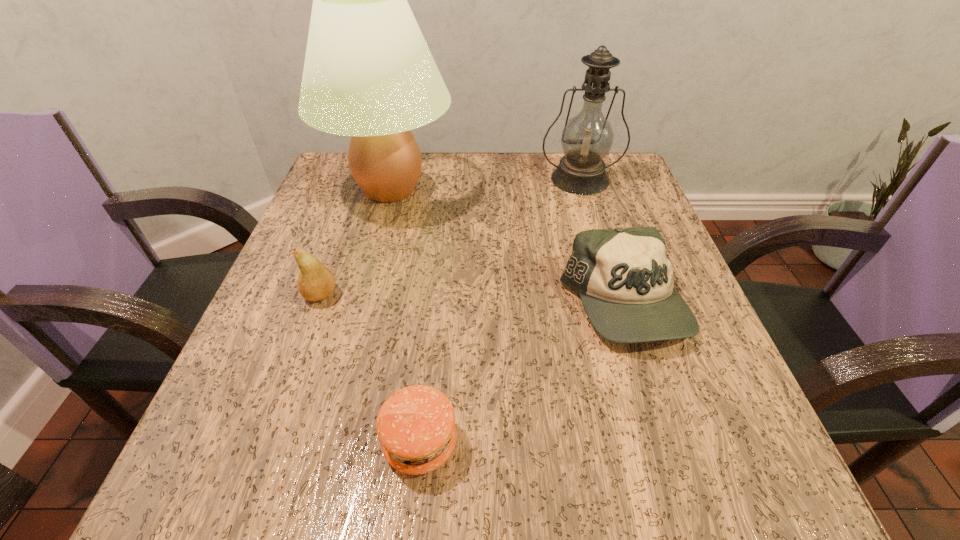
Where is `vacant region at the far edge`? Image resolution: width=960 pixels, height=540 pixels. vacant region at the far edge is located at coordinates (523, 174).

You are a GUI agent. You are given a task and a screenshot of the screen. Output one action in this format:
    pyautogui.click(x=<x>, y=<y>)
    Task: Click on the free space at the near edge of the desktop
    The height and width of the screenshot is (540, 960).
    Given the screenshot: What is the action you would take?
    pyautogui.click(x=597, y=448)

Identify the location of free point at the left edge. (372, 209).

The height and width of the screenshot is (540, 960). In the image, there is a desktop. Identify the location of vacant space at the right edge. (711, 426).

I want to click on free space at the far left corner of the desktop, so click(x=352, y=191).

In the image, there is a desktop. Where is `vacant space at the near left corner`? The height and width of the screenshot is (540, 960). vacant space at the near left corner is located at coordinates (230, 492).

Identify the location of vacant area that lies between the nearest object and the baseball cap. 522,374.

Identify the location of vacant point located between the baseball cap and the nearest object. (522, 374).

Image resolution: width=960 pixels, height=540 pixels. Find the location of `vacant space that is in between the tallest object and the oil lamp`. vacant space that is in between the tallest object and the oil lamp is located at coordinates (485, 184).

Identify the location of empty location between the tallest object and the pear. (355, 242).